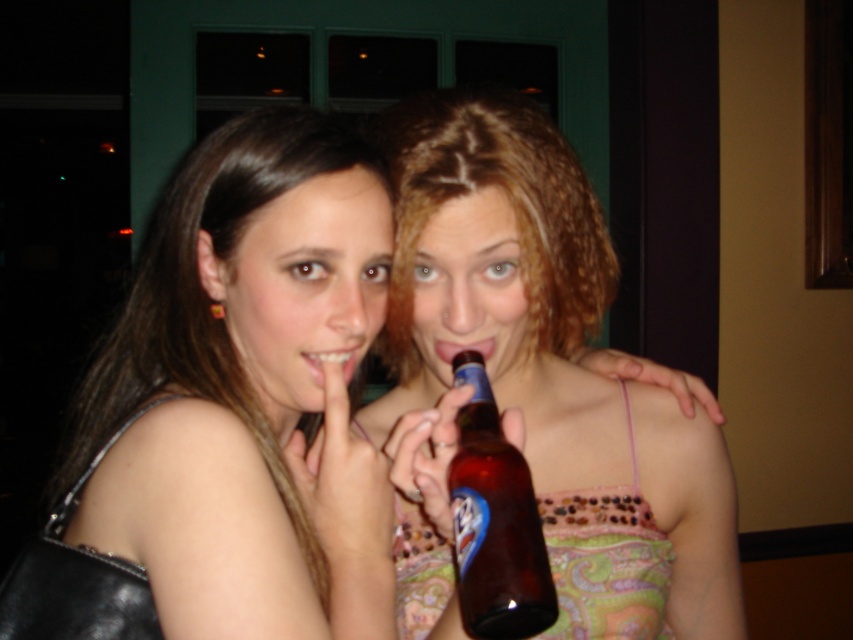
You are at a party and want to take a photo of both people in the image. The photographer is standing at the same position as the photographer who took the original image. To ensure both people are in focus, you need to know if they are on the same focal plane. Are the two points representing their positions, point (x=543, y=204) and point (x=534, y=609), on the same plane?

Point (x=543, y=204) is behind point (x=534, y=609), so they are not on the same focal plane. The photographer will need to adjust the focus to capture both clearly.

From the picture: You are a photographer at a social event. You want to take a photo of the matte black purse at left and the brown glass bottle at center without any objects in between them. Is there enough space between them to ensure they are both clearly visible in the frame?

The matte black purse at left and brown glass bottle at center are 7.35 inches apart from each other, so yes, there is enough space between them to ensure both are clearly visible in the frame without any objects blocking the view.

You are organizing a small party and need to place both the matte black purse at left and the brown glass bottle at center on a narrow shelf. The shelf can only hold items that are narrower than 20 cm. Based on the image, can both items fit on the shelf?

The matte black purse at left has a larger width than the brown glass bottle at center. Since the shelf requires items narrower than 20 cm, we need to check both widths. If the purse is wider than 20 cm, it won